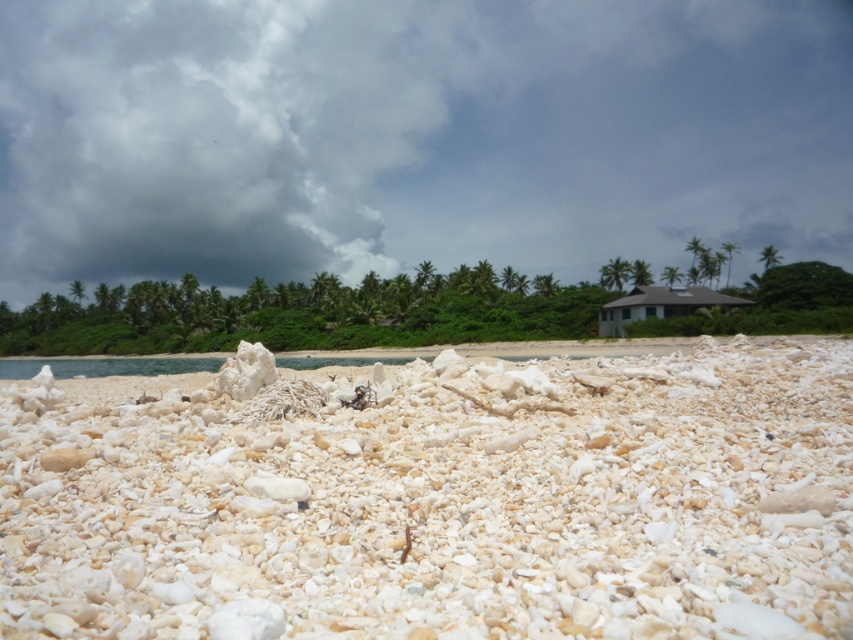
You are standing on the beach and looking towards the cloudy sky at upper center. There is white gravel at center in front of you. Which object is closer to you?

The white gravel at center is behind the cloudy sky at upper center, so the cloudy sky at upper center is closer to you.

You are a photographer planning to capture the cloudy sky at upper center and the white gravel at center in a single shot. Based on their sizes in the image, which object would occupy more of the frame?

The cloudy sky at upper center occupies more of the frame because its width is larger than that of the white gravel at center.